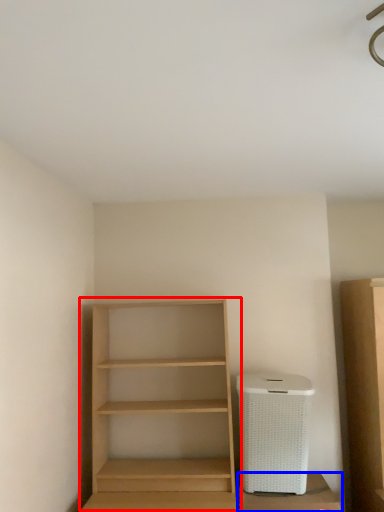
Question: Which of the following is the farthest to the observer, shelf (highlighted by a red box) or cabinetry (highlighted by a blue box)?

Choices:
 (A) shelf
 (B) cabinetry

Answer: (B)